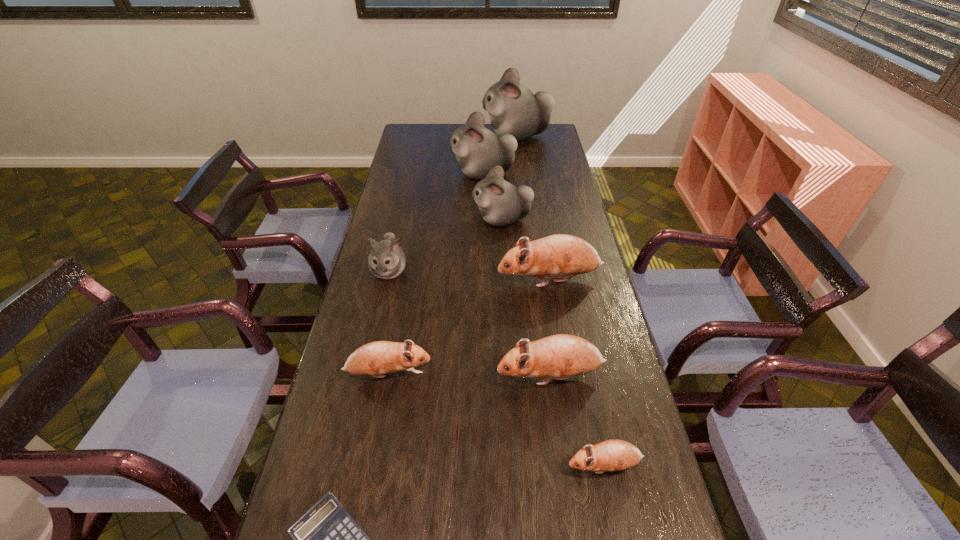
Locate an element on the screen. The image size is (960, 540). the third biggest brown hamster is located at coordinates (376, 358).

Find the location of a particular element. This screenshot has width=960, height=540. the seventh tallest object is located at coordinates click(376, 358).

The image size is (960, 540). Find the location of `the eighth tallest object`. the eighth tallest object is located at coordinates (611, 455).

Identify the location of the eighth farthest object. (611, 455).

Find the location of `vacant space located on the face of the farthest hamster`. vacant space located on the face of the farthest hamster is located at coordinates (448, 136).

Image resolution: width=960 pixels, height=540 pixels. I want to click on vacant space situated on the face of the farthest hamster, so click(x=416, y=136).

Find the location of `vacant area situated 0.250m on the face of the farthest hamster`. vacant area situated 0.250m on the face of the farthest hamster is located at coordinates (435, 136).

Identify the location of free space located 0.160m on the face of the second tallest object. (416, 174).

What are the coordinates of `vacant area situated on the face of the second tallest object` in the screenshot? It's located at (403, 174).

I want to click on vacant region located 0.210m on the face of the second tallest object, so click(405, 174).